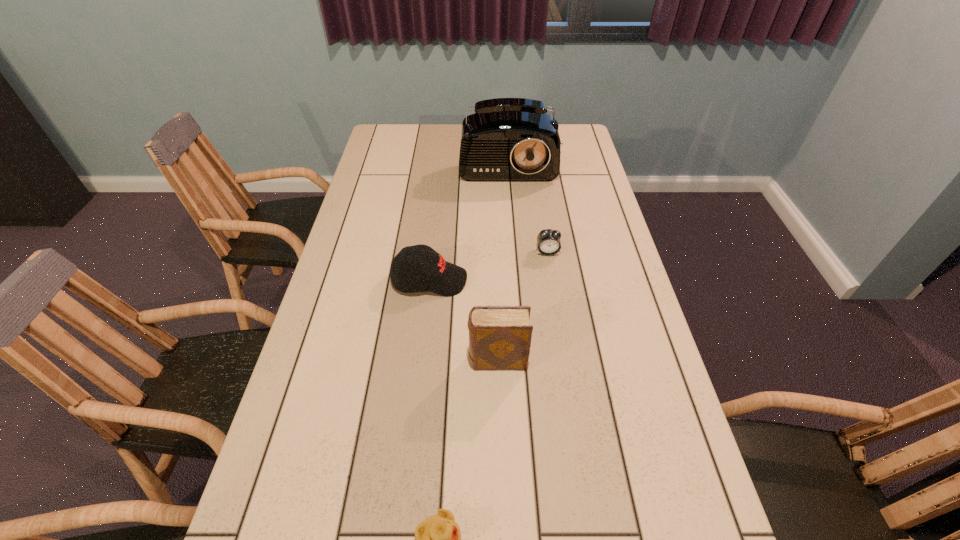
Find the location of a particular element. The image size is (960, 540). the farthest object is located at coordinates (507, 139).

Find the location of a particular element. Image resolution: width=960 pixels, height=540 pixels. radio receiver is located at coordinates (507, 139).

Where is `the second nearest object`? The image size is (960, 540). the second nearest object is located at coordinates (500, 337).

Identify the location of diary. (500, 337).

The width and height of the screenshot is (960, 540). What are the coordinates of `the third nearest object` in the screenshot? It's located at (429, 271).

In order to click on baseball cap in this screenshot , I will do `click(429, 271)`.

Identify the location of alarm clock. 548,241.

You are a GUI agent. You are given a task and a screenshot of the screen. Output one action in this format:
    pyautogui.click(x=<x>, y=<y>)
    Task: Click on the fourth tallest object
    This screenshot has height=540, width=960.
    Given the screenshot: What is the action you would take?
    pos(548,241)

Find the location of a particular element. vacant area situated 0.340m on the front-facing side of the radio receiver is located at coordinates (516, 247).

Where is `vacant space located 0.230m on the spine side of the diary`? Image resolution: width=960 pixels, height=540 pixels. vacant space located 0.230m on the spine side of the diary is located at coordinates (374, 361).